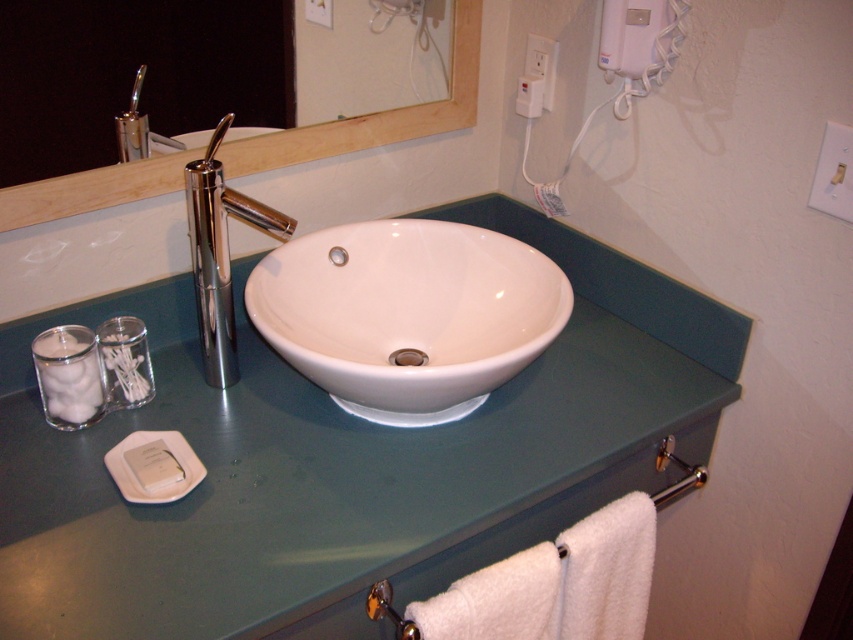
Is point (387, 138) positioned in front of point (271, 227)?

No, (387, 138) is behind (271, 227).

Between wooden-framed mirror at upper center and polished chrome faucet at center, which one appears on the right side from the viewer's perspective?

From the viewer's perspective, wooden-framed mirror at upper center appears more on the right side.

Is point (474, 77) positioned after point (209, 218)?

Yes.

This screenshot has height=640, width=853. I want to click on wooden-framed mirror at upper center, so click(374, 115).

Where is `white glossy sink at center`? The width and height of the screenshot is (853, 640). white glossy sink at center is located at coordinates (407, 314).

Does white glossy sink at center appear on the left side of wooden-framed mirror at upper center?

Incorrect, white glossy sink at center is not on the left side of wooden-framed mirror at upper center.

Is point (323, 333) closer to camera compared to point (386, 122)?

Yes, point (323, 333) is closer to viewer.

At what (x,y) coordinates should I click in order to perform the action: click on white glossy sink at center. Please return your answer as a coordinate pair (x, y). Looking at the image, I should click on (407, 314).

Does green matte countertop at center have a lesser width compared to polished chrome faucet at center?

No, green matte countertop at center is not thinner than polished chrome faucet at center.

What are the coordinates of `green matte countertop at center` in the screenshot? It's located at (345, 460).

Find the location of a particular element. The height and width of the screenshot is (640, 853). green matte countertop at center is located at coordinates (345, 460).